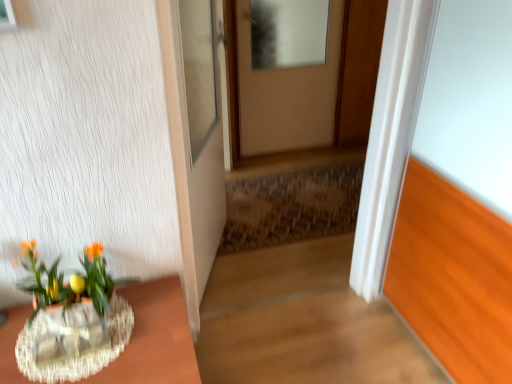
Image resolution: width=512 pixels, height=384 pixels. What do you see at coordinates (70, 333) in the screenshot?
I see `clear glass vase at lower left` at bounding box center [70, 333].

Measure the distance between point (115, 309) and camera.

A distance of 4.89 feet exists between point (115, 309) and camera.

In order to click on white glossy door at center, which appears as the 2th door when viewed from the back in this screenshot , I will do `click(201, 126)`.

Measure the distance between rustic wooden stairwell at center and camera.

rustic wooden stairwell at center is 8.20 feet away from camera.

Locate an element on the screen. clear glass vase at lower left is located at coordinates (70, 333).

Is translucent glass vase at lower left far from white glossy door at center, placed as the 1th door when sorted from front to back?

No, there isn't a large distance between translucent glass vase at lower left and white glossy door at center, placed as the 1th door when sorted from front to back.

Locate an element on the screen. vase below the white glossy door at center, the first door viewed from the left (from the image's perspective) is located at coordinates (80, 356).

Can you confirm if translucent glass vase at lower left is shorter than white glossy door at center, the first door viewed from the left?

Indeed, translucent glass vase at lower left has a lesser height compared to white glossy door at center, the first door viewed from the left.

Which is more to the left, translucent glass vase at lower left or rustic wooden stairwell at center?

translucent glass vase at lower left is more to the left.

From a real-world perspective, is translucent glass vase at lower left positioned under rustic wooden stairwell at center based on gravity?

No.

The width and height of the screenshot is (512, 384). What are the coordinates of `vase above the rustic wooden stairwell at center (from a real-world perspective)` in the screenshot? It's located at (80, 356).

Is translucent glass vase at lower left touching rustic wooden stairwell at center?

No, translucent glass vase at lower left is not beside rustic wooden stairwell at center.

How many degrees apart are the facing directions of matte beige door at center, acting as the second door starting from the front, and rustic wooden stairwell at center?

They differ by 91.2 degrees in their facing directions.

Is point (338, 59) farther from camera compared to point (356, 163)?

No, (338, 59) is closer to viewer.

From the image's perspective, is matte beige door at center, which is the first door in back-to-front order, above rustic wooden stairwell at center?

Yes, from the image's perspective, matte beige door at center, which is the first door in back-to-front order, is over rustic wooden stairwell at center.

Can you confirm if matte beige door at center, placed as the 1th door when sorted from right to left, is wider than rustic wooden stairwell at center?

No.

Is clear glass vase at lower left further to the viewer compared to translucent glass vase at lower left?

Yes, clear glass vase at lower left is further from the viewer.

From a real-world perspective, is clear glass vase at lower left located beneath translucent glass vase at lower left?

No, from a real-world perspective, clear glass vase at lower left is not under translucent glass vase at lower left.

Who is taller, clear glass vase at lower left or translucent glass vase at lower left?

clear glass vase at lower left.

Is translucent glass vase at lower left located within clear glass vase at lower left?

No, clear glass vase at lower left does not contain translucent glass vase at lower left.

From a real-world perspective, which is physically above, translucent glass vase at lower left or clear glass vase at lower left?

In real-world perspective, clear glass vase at lower left is above.

Is the depth of translucent glass vase at lower left less than that of clear glass vase at lower left?

Yes, translucent glass vase at lower left is in front of clear glass vase at lower left.

Does translucent glass vase at lower left appear on the left side of clear glass vase at lower left?

Indeed, translucent glass vase at lower left is positioned on the left side of clear glass vase at lower left.

Based on their sizes in the image, would you say white glossy door at center, the first door viewed from the left, is bigger or smaller than rustic wooden stairwell at center?

Clearly, white glossy door at center, the first door viewed from the left, is larger in size than rustic wooden stairwell at center.

In order to click on stairwell below the white glossy door at center, placed as the 1th door when sorted from front to back (from a real-world perspective) in this screenshot , I will do `click(291, 206)`.

From the image's perspective, is white glossy door at center, placed as the 1th door when sorted from front to back, positioned above or below rustic wooden stairwell at center?

white glossy door at center, placed as the 1th door when sorted from front to back, is situated higher than rustic wooden stairwell at center in the image.

Find the location of a particular element. the 2nd door behind the clear glass vase at lower left, starting your count from the anchor is located at coordinates (287, 73).

Considering the relative sizes of matte beige door at center, which is the second door in left-to-right order, and clear glass vase at lower left in the image provided, is matte beige door at center, which is the second door in left-to-right order, smaller than clear glass vase at lower left?

Incorrect, matte beige door at center, which is the second door in left-to-right order, is not smaller in size than clear glass vase at lower left.

Is matte beige door at center, placed as the 1th door when sorted from right to left, outside of clear glass vase at lower left?

Yes, matte beige door at center, placed as the 1th door when sorted from right to left, is not within clear glass vase at lower left.

From the image's perspective, starting from the translucent glass vase at lower left, which door is the 1st one above? Please provide its 2D coordinates.

[(201, 126)]

Image resolution: width=512 pixels, height=384 pixels. Identify the location of stairwell that appears below the translucent glass vase at lower left (from a real-world perspective). (291, 206).

From the image, which object appears to be farther from clear glass vase at lower left, matte beige door at center, which is the second door in left-to-right order, or rustic wooden stairwell at center?

The object further to clear glass vase at lower left is matte beige door at center, which is the second door in left-to-right order.

When comparing their distances from clear glass vase at lower left, does translucent glass vase at lower left or rustic wooden stairwell at center seem closer?

Among the two, translucent glass vase at lower left is located nearer to clear glass vase at lower left.

Which object lies further to the anchor point matte beige door at center, which is the first door in back-to-front order, white glossy door at center, the first door viewed from the left, or clear glass vase at lower left?

Among the two, clear glass vase at lower left is located further to matte beige door at center, which is the first door in back-to-front order.

Looking at the image, which one is located closer to translucent glass vase at lower left, clear glass vase at lower left or white glossy door at center, which appears as the 2th door when viewed from the back?

Among the two, clear glass vase at lower left is located nearer to translucent glass vase at lower left.

From the image, which object appears to be farther from rustic wooden stairwell at center, clear glass vase at lower left or white glossy door at center, which ranks as the 2th door in right-to-left order?

Based on the image, clear glass vase at lower left appears to be further to rustic wooden stairwell at center.

Looking at the image, which one is located further to clear glass vase at lower left, white glossy door at center, the first door viewed from the left, or rustic wooden stairwell at center?

Based on the image, rustic wooden stairwell at center appears to be further to clear glass vase at lower left.

Looking at the image, which one is located closer to white glossy door at center, placed as the 1th door when sorted from front to back, translucent glass vase at lower left or clear glass vase at lower left?

translucent glass vase at lower left lies closer to white glossy door at center, placed as the 1th door when sorted from front to back, than the other object.

When comparing their distances from rustic wooden stairwell at center, does translucent glass vase at lower left or clear glass vase at lower left seem further?

clear glass vase at lower left lies further to rustic wooden stairwell at center than the other object.

This screenshot has width=512, height=384. I want to click on door between translucent glass vase at lower left and rustic wooden stairwell at center along the z-axis, so click(x=201, y=126).

This screenshot has width=512, height=384. Find the location of `stairwell between clear glass vase at lower left and matte beige door at center, which is the first door in back-to-front order, along the z-axis`. stairwell between clear glass vase at lower left and matte beige door at center, which is the first door in back-to-front order, along the z-axis is located at coordinates (291, 206).

Where is `glass vase between translucent glass vase at lower left and rustic wooden stairwell at center from front to back`? glass vase between translucent glass vase at lower left and rustic wooden stairwell at center from front to back is located at coordinates (70, 333).

Where is `door located between translucent glass vase at lower left and matte beige door at center, which is the first door in back-to-front order, in the depth direction`? This screenshot has height=384, width=512. door located between translucent glass vase at lower left and matte beige door at center, which is the first door in back-to-front order, in the depth direction is located at coordinates (201, 126).